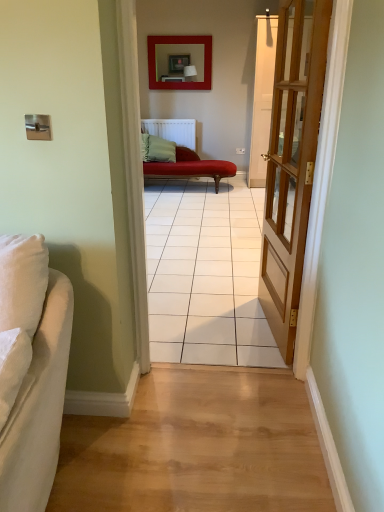
Describe the element at coordinates (292, 161) in the screenshot. I see `light brown wooden door at right` at that location.

The height and width of the screenshot is (512, 384). What do you see at coordinates (180, 62) in the screenshot?
I see `matte red picture frame at upper center` at bounding box center [180, 62].

I want to click on velvet red chaise at center, which ranks as the second studio couch in bottom-to-top order, so click(189, 167).

What do you see at coordinates (31, 370) in the screenshot?
I see `white fabric couch at left, the 2th studio couch in the back-to-front sequence` at bounding box center [31, 370].

What do you see at coordinates (197, 447) in the screenshot?
I see `light wood floor at center` at bounding box center [197, 447].

You are a GUI agent. You are given a task and a screenshot of the screen. Output one action in this format:
    pyautogui.click(x=<x>, y=<y>)
    Task: Click on the light brown wooden door at right
    
    Given the screenshot: What is the action you would take?
    pyautogui.click(x=292, y=161)

From a real-world perspective, is light brown wooden door at right positioned above or below velvet red chaise at center, the 1th studio couch positioned from the back?

From a real-world perspective, light brown wooden door at right is physically above velvet red chaise at center, the 1th studio couch positioned from the back.

Is light brown wooden door at right oriented away from velvet red chaise at center, which is the second studio couch in left-to-right order?

That's not correct — light brown wooden door at right is not looking away from velvet red chaise at center, which is the second studio couch in left-to-right order.

Which of these two, light brown wooden door at right or velvet red chaise at center, the 1th studio couch positioned from the back, is wider?

velvet red chaise at center, the 1th studio couch positioned from the back, is wider.

Based on the photo, is light wood floor at center looking in the opposite direction of velvet red chaise at center, which is the 1th studio couch from top to bottom?

No, light wood floor at center's orientation is not away from velvet red chaise at center, which is the 1th studio couch from top to bottom.

Where is `studio couch behind the light wood floor at center`? This screenshot has height=512, width=384. studio couch behind the light wood floor at center is located at coordinates (189, 167).

From a real-world perspective, is light wood floor at center on top of velvet red chaise at center, which is the 1th studio couch from top to bottom?

Incorrect, from a real-world perspective, light wood floor at center is lower than velvet red chaise at center, which is the 1th studio couch from top to bottom.

Is light wood floor at center to the left or to the right of velvet red chaise at center, the 2th studio couch in the front-to-back sequence, in the image?

light wood floor at center is to the left of velvet red chaise at center, the 2th studio couch in the front-to-back sequence.

Choose the correct answer: Is light wood floor at center inside matte red picture frame at upper center or outside it?

light wood floor at center is not inside matte red picture frame at upper center, it's outside.

Is light wood floor at center not near matte red picture frame at upper center?

Yes, light wood floor at center and matte red picture frame at upper center are quite far apart.

Find the location of a particular element. This screenshot has height=512, width=384. path below the matte red picture frame at upper center (from a real-world perspective) is located at coordinates (197, 447).

Is light wood floor at center smaller than matte red picture frame at upper center?

Yes.

From a real-world perspective, is matte red picture frame at upper center on top of white fabric couch at left, the 2th studio couch when ordered from right to left?

Yes.

At what (x,y) coordinates should I click in order to perform the action: click on picture frame on the right side of white fabric couch at left, the 2th studio couch when ordered from right to left. Please return your answer as a coordinate pair (x, y). The width and height of the screenshot is (384, 512). Looking at the image, I should click on (180, 62).

Is matte red picture frame at upper center not within white fabric couch at left, the 2th studio couch in the back-to-front sequence?

That's correct, matte red picture frame at upper center is outside of white fabric couch at left, the 2th studio couch in the back-to-front sequence.

From the image's perspective, would you say matte red picture frame at upper center is shown under white fabric couch at left, the first studio couch in the front-to-back sequence?

No.

Considering their positions, is white fabric couch at left, the 2th studio couch in the back-to-front sequence, located in front of or behind light wood floor at center?

white fabric couch at left, the 2th studio couch in the back-to-front sequence, is in front of light wood floor at center.

Consider the image. Would you consider white fabric couch at left, acting as the 1th studio couch starting from the left, to be distant from light wood floor at center?

They are positioned close to each other.

From a real-world perspective, is white fabric couch at left, the 2th studio couch in the back-to-front sequence, positioned under light wood floor at center based on gravity?

No.

In the scene shown: Which is correct: white fabric couch at left, the first studio couch in the front-to-back sequence, is inside light wood floor at center, or outside of it?

white fabric couch at left, the first studio couch in the front-to-back sequence, lies outside light wood floor at center.

Considering the sizes of objects light wood floor at center and white fabric couch at left, the first studio couch in the front-to-back sequence, in the image provided, who is smaller, light wood floor at center or white fabric couch at left, the first studio couch in the front-to-back sequence,?

Smaller between the two is light wood floor at center.

Is light wood floor at center beside white fabric couch at left, the 1th studio couch in the bottom-to-top sequence?

There is a gap between light wood floor at center and white fabric couch at left, the 1th studio couch in the bottom-to-top sequence.

Is light wood floor at center taller or shorter than white fabric couch at left, the 2th studio couch when ordered from right to left?

Considering their sizes, light wood floor at center has less height than white fabric couch at left, the 2th studio couch when ordered from right to left.

From the image's perspective, which one is positioned higher, light wood floor at center or white fabric couch at left, the 2th studio couch when ordered from top to bottom?

From the image's view, white fabric couch at left, the 2th studio couch when ordered from top to bottom, is above.

From a real-world perspective, is white fabric couch at left, the 2th studio couch in the back-to-front sequence, beneath velvet red chaise at center, the 2th studio couch in the front-to-back sequence?

No.

From the image's perspective, is white fabric couch at left, the 2th studio couch when ordered from top to bottom, above velvet red chaise at center, the first studio couch when ordered from right to left?

No, from the image's perspective, white fabric couch at left, the 2th studio couch when ordered from top to bottom, is not above velvet red chaise at center, the first studio couch when ordered from right to left.

Is point (22, 506) more distant than point (178, 155)?

No, it is not.

In terms of size, does white fabric couch at left, the 2th studio couch when ordered from top to bottom, appear bigger or smaller than velvet red chaise at center, the 2th studio couch in the front-to-back sequence?

In the image, white fabric couch at left, the 2th studio couch when ordered from top to bottom, appears to be smaller than velvet red chaise at center, the 2th studio couch in the front-to-back sequence.

Where is `door below the velvet red chaise at center, the 1th studio couch positioned from the back (from the image's perspective)`? The height and width of the screenshot is (512, 384). door below the velvet red chaise at center, the 1th studio couch positioned from the back (from the image's perspective) is located at coordinates (292, 161).

I want to click on path that appears in front of the velvet red chaise at center, the first studio couch when ordered from right to left, so click(197, 447).

Looking at the image, which one is located closer to velvet red chaise at center, the 2th studio couch in the front-to-back sequence, light brown wooden door at right or light wood floor at center?

light brown wooden door at right is closer to velvet red chaise at center, the 2th studio couch in the front-to-back sequence.

Considering their positions, is light brown wooden door at right positioned closer to white fabric couch at left, acting as the 1th studio couch starting from the left, than velvet red chaise at center, which ranks as the second studio couch in bottom-to-top order?

Based on the image, light brown wooden door at right appears to be nearer to white fabric couch at left, acting as the 1th studio couch starting from the left.

Looking at this image, looking at the image, which one is located further to matte red picture frame at upper center, light brown wooden door at right or white fabric couch at left, the 2th studio couch in the back-to-front sequence?

The object further to matte red picture frame at upper center is white fabric couch at left, the 2th studio couch in the back-to-front sequence.

Estimate the real-world distances between objects in this image. Which object is closer to matte red picture frame at upper center, white fabric couch at left, acting as the 1th studio couch starting from the left, or light brown wooden door at right?

light brown wooden door at right.

Which object lies further to the anchor point velvet red chaise at center, which is the second studio couch in left-to-right order, white fabric couch at left, the 2th studio couch when ordered from right to left, or light wood floor at center?

The object further to velvet red chaise at center, which is the second studio couch in left-to-right order, is white fabric couch at left, the 2th studio couch when ordered from right to left.

Estimate the real-world distances between objects in this image. Which object is closer to light brown wooden door at right, white fabric couch at left, acting as the 1th studio couch starting from the left, or velvet red chaise at center, which is the 1th studio couch from top to bottom?

Among the two, white fabric couch at left, acting as the 1th studio couch starting from the left, is located nearer to light brown wooden door at right.

Which object lies further to the anchor point white fabric couch at left, acting as the 1th studio couch starting from the left, matte red picture frame at upper center or velvet red chaise at center, the 2th studio couch in the front-to-back sequence?

matte red picture frame at upper center lies further to white fabric couch at left, acting as the 1th studio couch starting from the left, than the other object.

From the image, which object appears to be nearer to matte red picture frame at upper center, light brown wooden door at right or light wood floor at center?

light brown wooden door at right lies closer to matte red picture frame at upper center than the other object.

The image size is (384, 512). What are the coordinates of `door located between light wood floor at center and matte red picture frame at upper center in the depth direction` in the screenshot? It's located at (292, 161).

The image size is (384, 512). Identify the location of studio couch positioned between light wood floor at center and matte red picture frame at upper center from near to far. (189, 167).

Identify the location of door positioned between light wood floor at center and velvet red chaise at center, the first studio couch when ordered from right to left, from near to far. Image resolution: width=384 pixels, height=512 pixels. (292, 161).

Where is `studio couch between light brown wooden door at right and light wood floor at center in the vertical direction`? This screenshot has height=512, width=384. studio couch between light brown wooden door at right and light wood floor at center in the vertical direction is located at coordinates (31, 370).